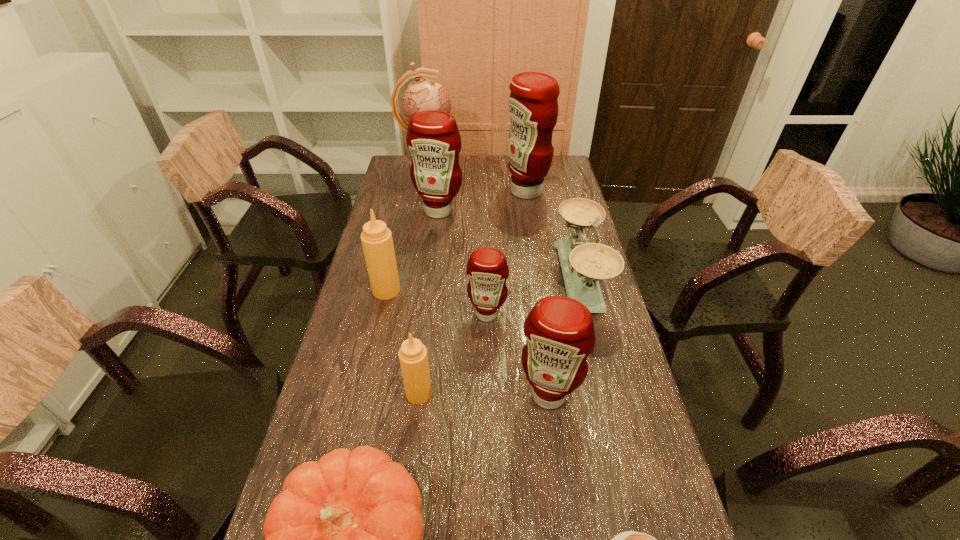
Identify the location of vacant space situated on the front-facing side of the scale. (483, 278).

The width and height of the screenshot is (960, 540). I want to click on vacant space situated on the back of the nearer tan condiment, so click(425, 340).

What are the coordinates of `blank space located 0.090m on the left of the smallest red condiment` in the screenshot? It's located at (437, 314).

Identify the location of condiment present at the far edge. This screenshot has height=540, width=960. (533, 106).

This screenshot has width=960, height=540. In order to click on globe that is at the far edge in this screenshot , I will do `click(424, 94)`.

Where is `globe at the left edge`? globe at the left edge is located at coordinates point(424,94).

Locate an element on the screen. scale that is at the right edge is located at coordinates (583, 264).

Identify the location of object at the far left corner. Image resolution: width=960 pixels, height=540 pixels. (424, 94).

Where is `object located in the far right corner section of the desktop`? object located in the far right corner section of the desktop is located at coordinates (533, 106).

In the image, there is a desktop. Identify the location of blank space at the far edge. (492, 171).